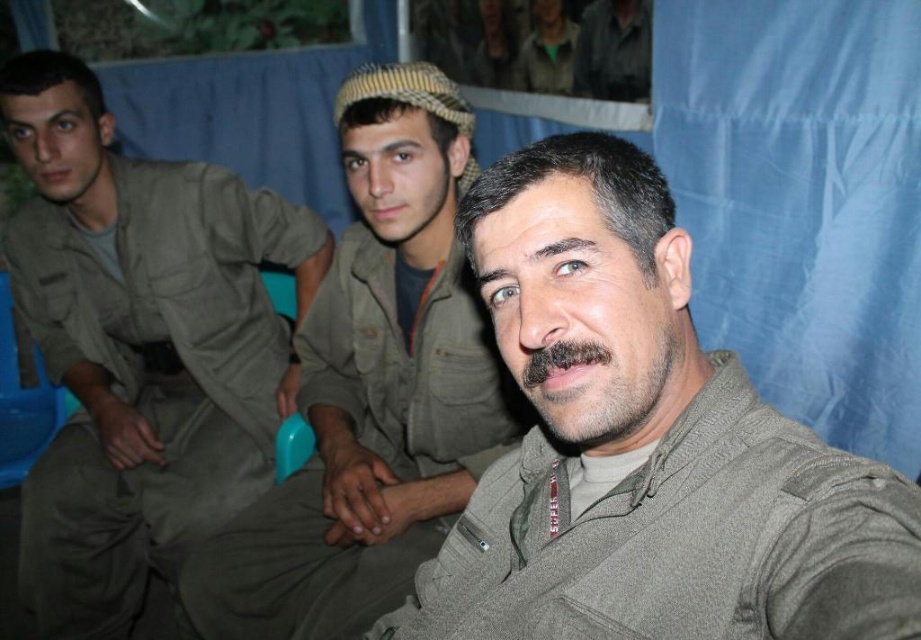
You are a photographer setting up for a group photo. You notice the two individuals wearing the matte khaki uniform at left and the matte khaki uniform at center. Which one is covering part of the other in the image?

The matte khaki uniform at left is positioned over the matte khaki uniform at center, meaning the one at left is covering part of the one at center.

Based on the scene described, which object is positioned lower in the image between the gray woolen jacket at center and the dark brown fuzzy beard at center?

The gray woolen jacket at center is located below the dark brown fuzzy beard at center, so it is positioned lower in the image.